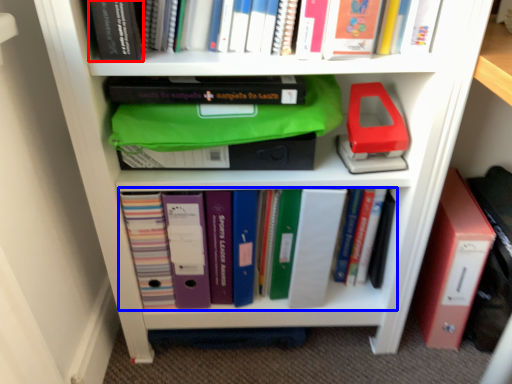
Question: Which of the following is the closest to the observer, book (highlighted by a red box) or book (highlighted by a blue box)?

Choices:
 (A) book
 (B) book

Answer: (A)